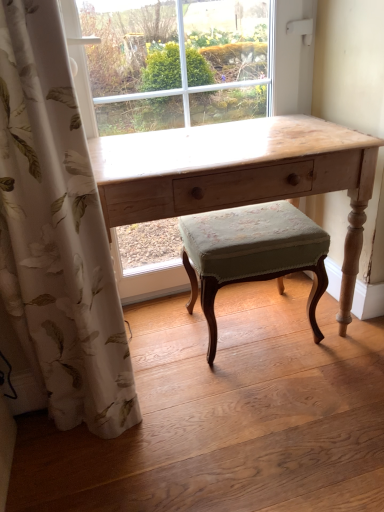
Question: Does green fabric stool at center appear on the right side of light wood desk at center?

Choices:
 (A) no
 (B) yes

Answer: (B)

Question: From a real-world perspective, is green fabric stool at center beneath light wood desk at center?

Choices:
 (A) yes
 (B) no

Answer: (A)

Question: Could you tell me if green fabric stool at center is facing light wood desk at center?

Choices:
 (A) yes
 (B) no

Answer: (A)

Question: From the image's perspective, is green fabric stool at center located above light wood desk at center?

Choices:
 (A) no
 (B) yes

Answer: (A)

Question: Does green fabric stool at center touch light wood desk at center?

Choices:
 (A) yes
 (B) no

Answer: (B)

Question: Visually, is green fabric stool at center positioned to the left or to the right of light wood desk at center?

Choices:
 (A) right
 (B) left

Answer: (A)

Question: Considering the positions of green fabric stool at center and light wood desk at center in the image, is green fabric stool at center taller or shorter than light wood desk at center?

Choices:
 (A) short
 (B) tall

Answer: (A)

Question: From the image's perspective, is green fabric stool at center positioned above or below light wood desk at center?

Choices:
 (A) below
 (B) above

Answer: (A)

Question: Is point (210, 303) closer or farther from the camera than point (357, 240)?

Choices:
 (A) farther
 (B) closer

Answer: (A)

Question: From the image's perspective, relative to white floral fabric curtain at left, is light wood desk at center above or below?

Choices:
 (A) above
 (B) below

Answer: (A)

Question: Is light wood desk at center situated inside white floral fabric curtain at left or outside?

Choices:
 (A) outside
 (B) inside

Answer: (A)

Question: In the image, is light wood desk at center on the left side or the right side of white floral fabric curtain at left?

Choices:
 (A) right
 (B) left

Answer: (A)

Question: Is light wood desk at center taller or shorter than white floral fabric curtain at left?

Choices:
 (A) tall
 (B) short

Answer: (B)

Question: Would you say white floral fabric curtain at left is to the left or to the right of light wood desk at center in the picture?

Choices:
 (A) left
 (B) right

Answer: (A)

Question: From the image's perspective, is white floral fabric curtain at left above or below light wood desk at center?

Choices:
 (A) below
 (B) above

Answer: (A)